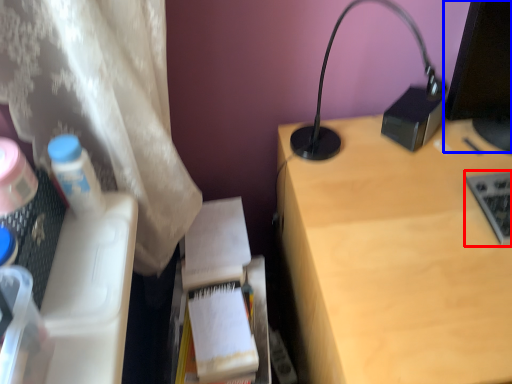
Question: Which point is further to the camera, laptop keyboard (highlighted by a red box) or computer screen (highlighted by a blue box)?

Choices:
 (A) laptop keyboard
 (B) computer screen

Answer: (A)